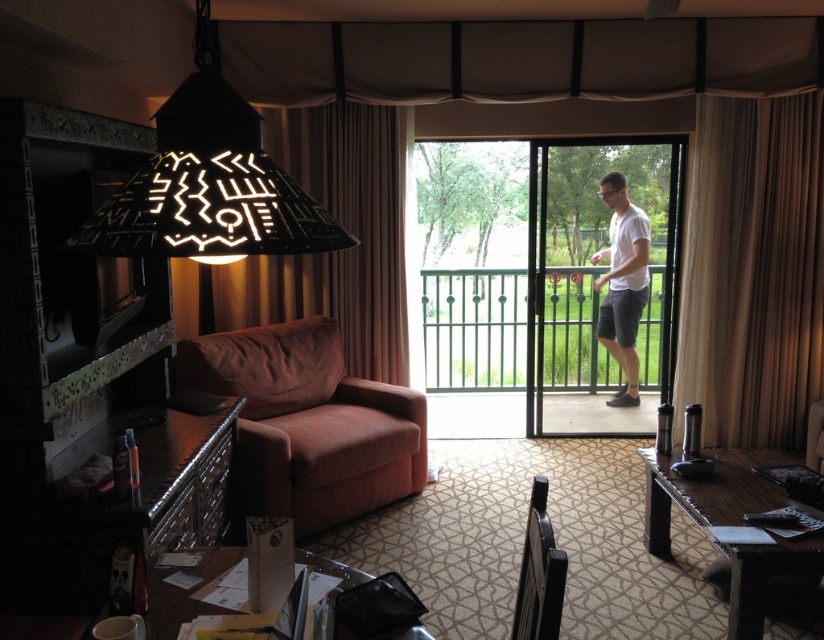
Question: Which of the following is the closest to the observer?

Choices:
 (A) clear glass screen door at center
 (B) brown fabric curtain at center

Answer: (B)

Question: Can you confirm if brown fabric curtain at center is bigger than black leather armchair at lower center?

Choices:
 (A) no
 (B) yes

Answer: (B)

Question: Is white cotton t-shirt at center to the left of black leather armchair at lower center from the viewer's perspective?

Choices:
 (A) yes
 (B) no

Answer: (B)

Question: Among these points, which one is farthest from the camera?

Choices:
 (A) (522, 573)
 (B) (656, 328)

Answer: (B)

Question: Does clear glass screen door at center appear on the right side of brown fabric armchair at lower left?

Choices:
 (A) yes
 (B) no

Answer: (A)

Question: Which object is the farthest from the brown fabric armchair at lower left?

Choices:
 (A) white cotton t-shirt at center
 (B) black leather armchair at lower center
 (C) black matte lampshade at upper left

Answer: (C)